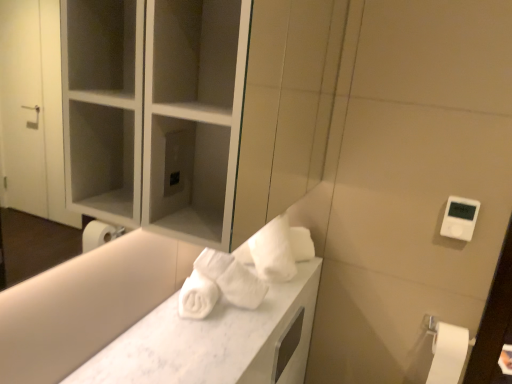
Question: Does white matte toilet paper at lower right have a smaller size compared to white marble counter top at center?

Choices:
 (A) no
 (B) yes

Answer: (B)

Question: Does white matte toilet paper at lower right have a greater width compared to white marble counter top at center?

Choices:
 (A) yes
 (B) no

Answer: (B)

Question: Is the depth of white matte toilet paper at lower right greater than that of white marble counter top at center?

Choices:
 (A) yes
 (B) no

Answer: (A)

Question: From the image's perspective, is white matte toilet paper at lower right located beneath white marble counter top at center?

Choices:
 (A) no
 (B) yes

Answer: (B)

Question: Does white matte toilet paper at lower right have a larger size compared to white marble counter top at center?

Choices:
 (A) yes
 (B) no

Answer: (B)

Question: Is white matte toilet paper at lower right far away from white marble counter top at center?

Choices:
 (A) yes
 (B) no

Answer: (B)

Question: Does white marble counter top at center have a greater width compared to white matte toilet paper at lower right?

Choices:
 (A) no
 (B) yes

Answer: (B)

Question: Does white marble counter top at center appear on the left side of white matte toilet paper at lower right?

Choices:
 (A) no
 (B) yes

Answer: (B)

Question: Is white marble counter top at center not within white matte toilet paper at lower right?

Choices:
 (A) yes
 (B) no

Answer: (A)

Question: From a real-world perspective, is white marble counter top at center under white matte toilet paper at lower right?

Choices:
 (A) yes
 (B) no

Answer: (B)

Question: From a real-world perspective, does white marble counter top at center stand above white matte toilet paper at lower right?

Choices:
 (A) yes
 (B) no

Answer: (A)

Question: From the image's perspective, would you say white marble counter top at center is positioned over white matte toilet paper at lower right?

Choices:
 (A) yes
 (B) no

Answer: (A)

Question: Would you say white matte toilet paper at lower right is to the left or to the right of white marble counter top at center in the picture?

Choices:
 (A) right
 (B) left

Answer: (A)